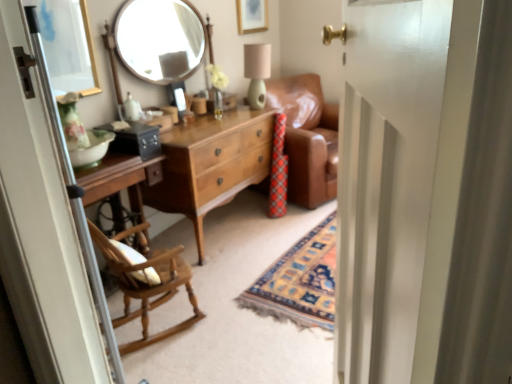
Question: Can you confirm if matte green lampshade at upper center is bigger than white glossy door at center, which ranks as the 2th screen door in left-to-right order?

Choices:
 (A) no
 (B) yes

Answer: (A)

Question: Considering the relative positions of matte green lampshade at upper center and white glossy door at center, which appears as the first screen door when viewed from the right, in the image provided, is matte green lampshade at upper center to the left of white glossy door at center, which appears as the first screen door when viewed from the right, from the viewer's perspective?

Choices:
 (A) yes
 (B) no

Answer: (A)

Question: Can you confirm if matte green lampshade at upper center is shorter than white glossy door at center, which appears as the first screen door when viewed from the right?

Choices:
 (A) no
 (B) yes

Answer: (B)

Question: Is the depth of matte green lampshade at upper center greater than that of white glossy door at center, which appears as the first screen door when viewed from the right?

Choices:
 (A) yes
 (B) no

Answer: (A)

Question: Is matte green lampshade at upper center oriented towards white glossy door at center, which ranks as the 2th screen door in left-to-right order?

Choices:
 (A) no
 (B) yes

Answer: (A)

Question: From the image's perspective, is matte green lampshade at upper center located above white glossy door at center, which appears as the first screen door when viewed from the right?

Choices:
 (A) yes
 (B) no

Answer: (A)

Question: Is the position of white glossy door at center, which appears as the first screen door when viewed from the right, less distant than that of matte brown coffee cup at center?

Choices:
 (A) yes
 (B) no

Answer: (A)

Question: Is white glossy door at center, which appears as the first screen door when viewed from the right, next to matte brown coffee cup at center and touching it?

Choices:
 (A) yes
 (B) no

Answer: (B)

Question: From the image's perspective, would you say white glossy door at center, which appears as the first screen door when viewed from the right, is positioned over matte brown coffee cup at center?

Choices:
 (A) no
 (B) yes

Answer: (A)

Question: Can you confirm if white glossy door at center, which appears as the first screen door when viewed from the right, is positioned to the left of matte brown coffee cup at center?

Choices:
 (A) no
 (B) yes

Answer: (A)

Question: Is white glossy door at center, which appears as the first screen door when viewed from the right, aimed at matte brown coffee cup at center?

Choices:
 (A) no
 (B) yes

Answer: (A)

Question: Considering the relative positions of white glossy door at center, which ranks as the 2th screen door in left-to-right order, and matte brown coffee cup at center in the image provided, is white glossy door at center, which ranks as the 2th screen door in left-to-right order, behind matte brown coffee cup at center?

Choices:
 (A) yes
 (B) no

Answer: (B)

Question: Is light brown wood dresser at center not within gold-framed picture at upper center, which is counted as the 1th picture frame, starting from the back?

Choices:
 (A) no
 (B) yes

Answer: (B)